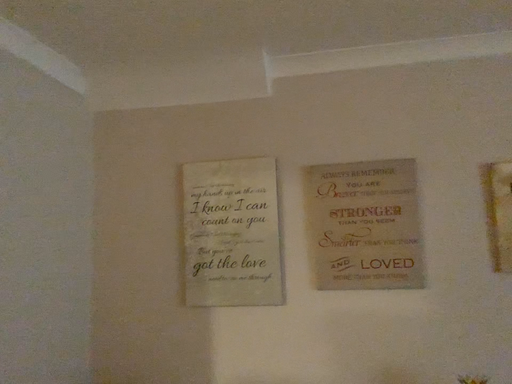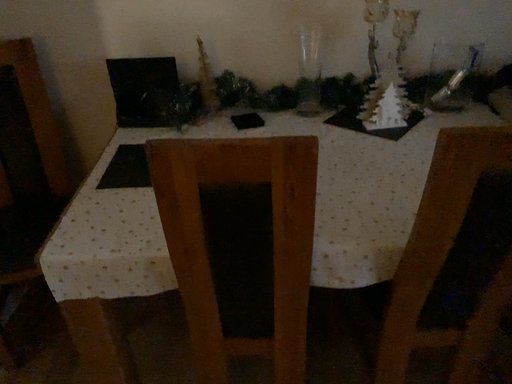
Question: How did the camera likely rotate when shooting the video?

Choices:
 (A) rotated left
 (B) rotated right

Answer: (B)